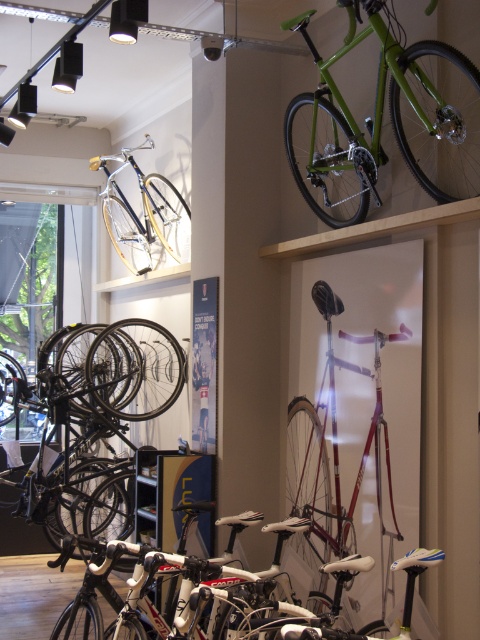
You are a customer in the bicycle shop and want to compare the green matte bicycle at upper right and the shiny purple bicycle at center. Which one is positioned to the right of the other?

The green matte bicycle at upper right is positioned to the right of the shiny purple bicycle at center.

Based on the photo, you are standing in the bicycle shop and want to reach a point that is exactly 4.47 meters away from you. Can you determine if the point at coordinates point (423, 74) is within your reach?

The point at coordinates point (423, 74) is exactly 4.47 meters away from the viewer, so yes, it is within your reach if you can reach that distance.

You are a customer in the bicycle shop and want to buy a bike that is larger in size. Which bike between the shiny black bike at lower left and the green matte bicycle at upper right should you choose?

The shiny black bike at lower left is bigger than the green matte bicycle at upper right, so you should choose the shiny black bike at lower left.